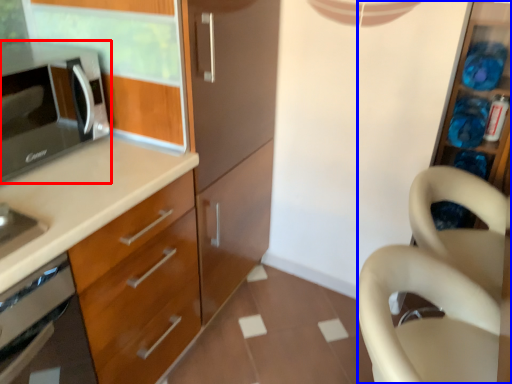
Question: Which of the following is the farthest to the observer, microwave oven (highlighted by a red box) or dresser (highlighted by a blue box)?

Choices:
 (A) microwave oven
 (B) dresser

Answer: (B)